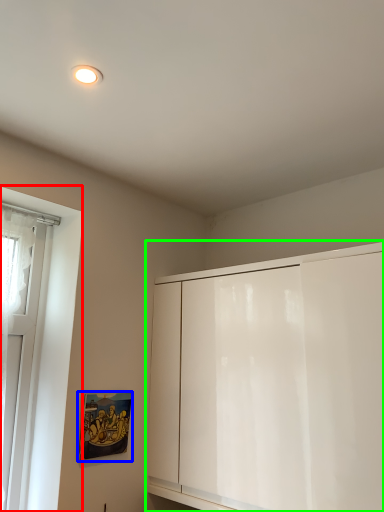
Question: Which is farther away from window (highlighted by a red box)? picture frame (highlighted by a blue box) or cabinetry (highlighted by a green box)?

Choices:
 (A) picture frame
 (B) cabinetry

Answer: (B)